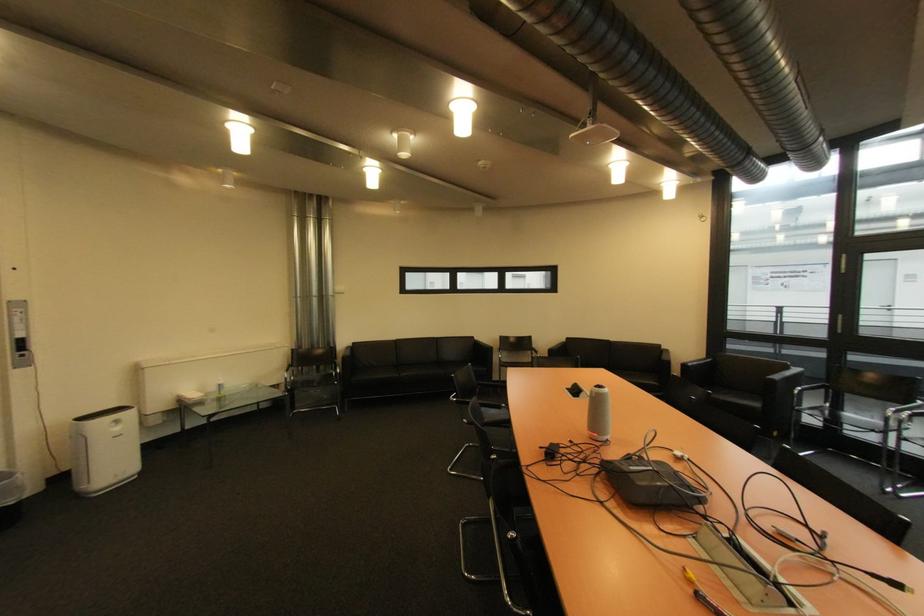
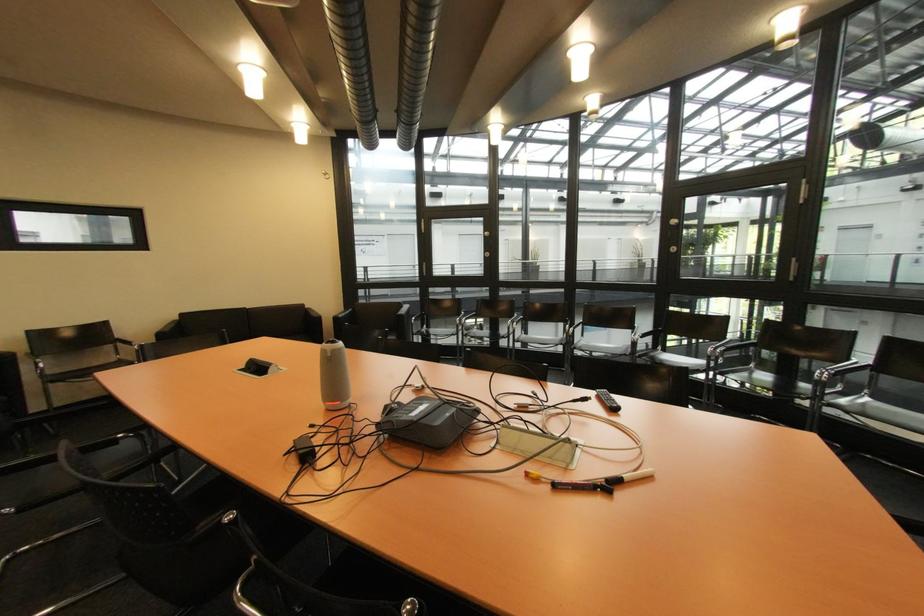
Question: The images are taken continuously from a first-person perspective. In which direction is your viewpoint rotating?

Choices:
 (A) Left
 (B) Right
 (C) Up
 (D) Down

Answer: (B)